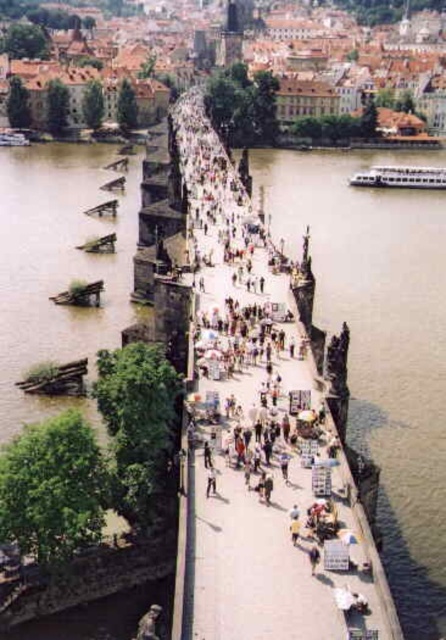
Question: Among these objects, which one is farthest from the camera?

Choices:
 (A) dark gray stone statue at center
 (B) brown water at lower right

Answer: (B)

Question: Among these objects, which one is nearest to the camera?

Choices:
 (A) brown water at lower right
 (B) dark gray stone statue at center

Answer: (B)

Question: From the image, what is the correct spatial relationship of brown water at lower right in relation to dark gray stone statue at center?

Choices:
 (A) above
 (B) below

Answer: (A)

Question: Where is brown water at lower right located in relation to dark gray stone statue at center in the image?

Choices:
 (A) above
 (B) below

Answer: (A)

Question: Which object appears closest to the camera in this image?

Choices:
 (A) brown water at lower right
 (B) dark gray stone statue at center

Answer: (B)

Question: Does brown water at lower right have a greater width compared to dark gray stone statue at center?

Choices:
 (A) no
 (B) yes

Answer: (B)